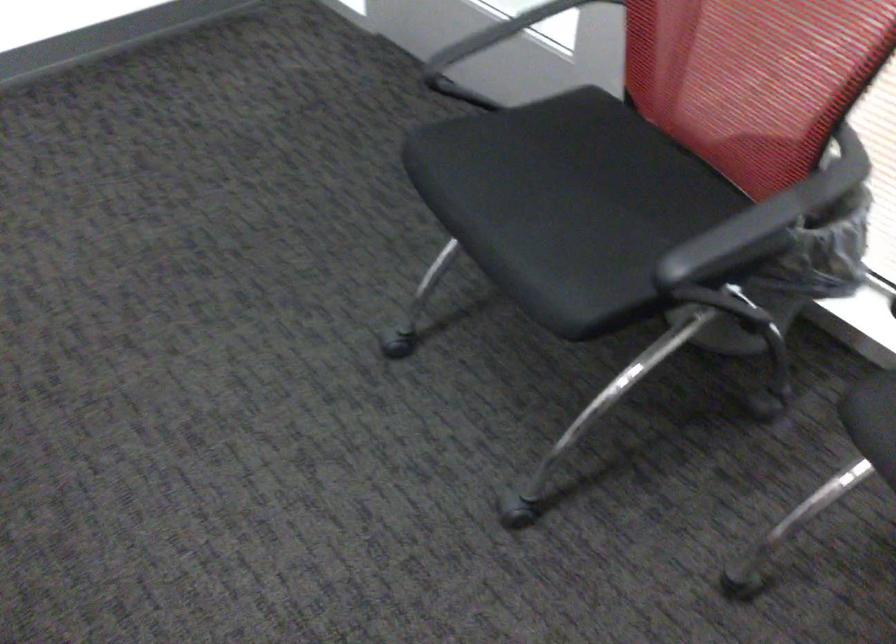
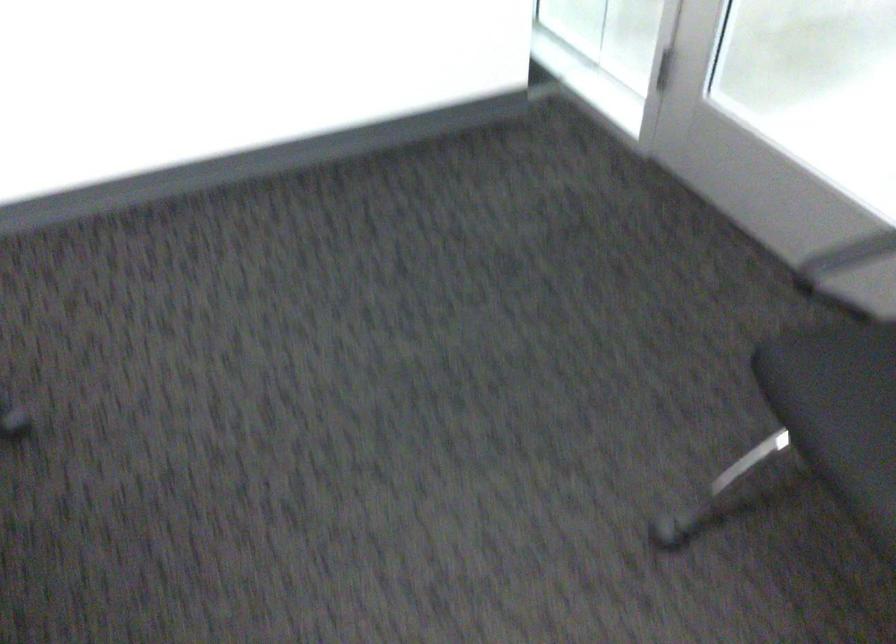
Where in the second image is the point corresponding to (x=472, y=189) from the first image?

(839, 410)